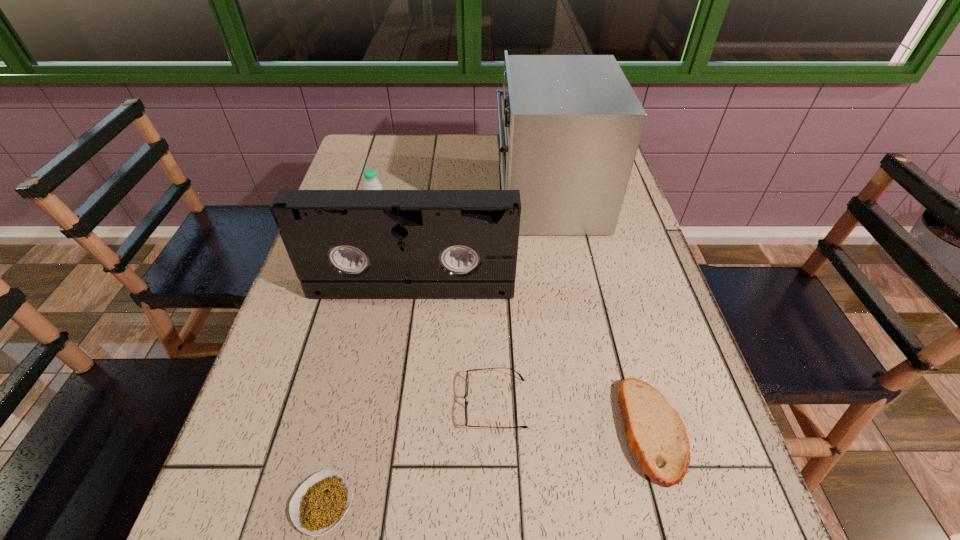
Find the location of a particular element. water bottle at the left edge is located at coordinates (372, 183).

At what (x,y) coordinates should I click in order to perform the action: click on legume that is at the left edge. Please return your answer as a coordinate pair (x, y). The image size is (960, 540). Looking at the image, I should click on (321, 502).

You are a GUI agent. You are given a task and a screenshot of the screen. Output one action in this format:
    pyautogui.click(x=<x>, y=<y>)
    Task: Click on the toaster oven that is positioned at the right edge
    This screenshot has height=540, width=960.
    Given the screenshot: What is the action you would take?
    pyautogui.click(x=570, y=125)

The width and height of the screenshot is (960, 540). I want to click on pita bread present at the right edge, so click(657, 436).

The image size is (960, 540). Find the location of `object present at the near left corner`. object present at the near left corner is located at coordinates (321, 502).

You are a GUI agent. You are given a task and a screenshot of the screen. Output one action in this format:
    pyautogui.click(x=<x>, y=<y>)
    Task: Click on the object at the far right corner
    Image resolution: width=960 pixels, height=540 pixels.
    Given the screenshot: What is the action you would take?
    pyautogui.click(x=570, y=125)

The height and width of the screenshot is (540, 960). Identify the location of free location at the near edge of the desktop. (433, 536).

Identify the location of vacant space at the left edge of the desktop. Image resolution: width=960 pixels, height=540 pixels. (280, 434).

The height and width of the screenshot is (540, 960). In order to click on free region at the right edge in this screenshot , I will do `click(663, 352)`.

Where is `free space at the far left corner of the desktop`? The image size is (960, 540). free space at the far left corner of the desktop is located at coordinates (393, 138).